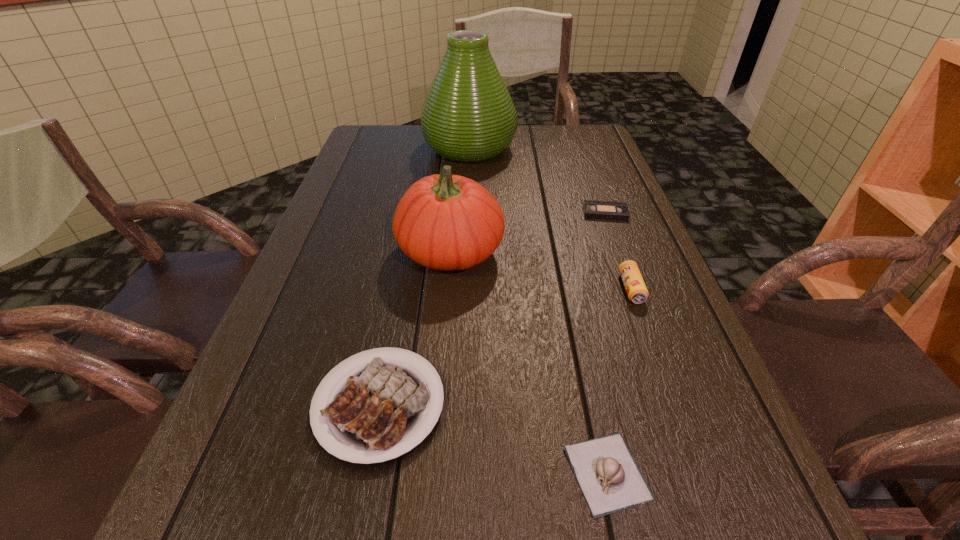
Find the location of a particular element. vase is located at coordinates tap(468, 116).

Locate an element on the screen. This screenshot has height=540, width=960. the tallest object is located at coordinates (468, 116).

The width and height of the screenshot is (960, 540). Identify the location of pumpkin. (446, 222).

You are a GUI agent. You are given a task and a screenshot of the screen. Output one action in this format:
    pyautogui.click(x=<x>, y=<y>)
    Task: Click on the beer can
    Image resolution: width=960 pixels, height=540 pixels.
    Given the screenshot: What is the action you would take?
    pyautogui.click(x=637, y=292)

The width and height of the screenshot is (960, 540). I want to click on the third shortest object, so click(x=375, y=411).

Identify the location of the fourth object from left to right. [x=610, y=480].

The width and height of the screenshot is (960, 540). Identify the location of garlic. (610, 480).

This screenshot has height=540, width=960. I want to click on the shortest object, so click(x=594, y=209).

I want to click on blank area located on the left of the tallest object, so click(x=372, y=148).

This screenshot has height=540, width=960. In order to click on vacant point located 0.200m on the front of the fifth shortest object in this screenshot , I will do `click(441, 367)`.